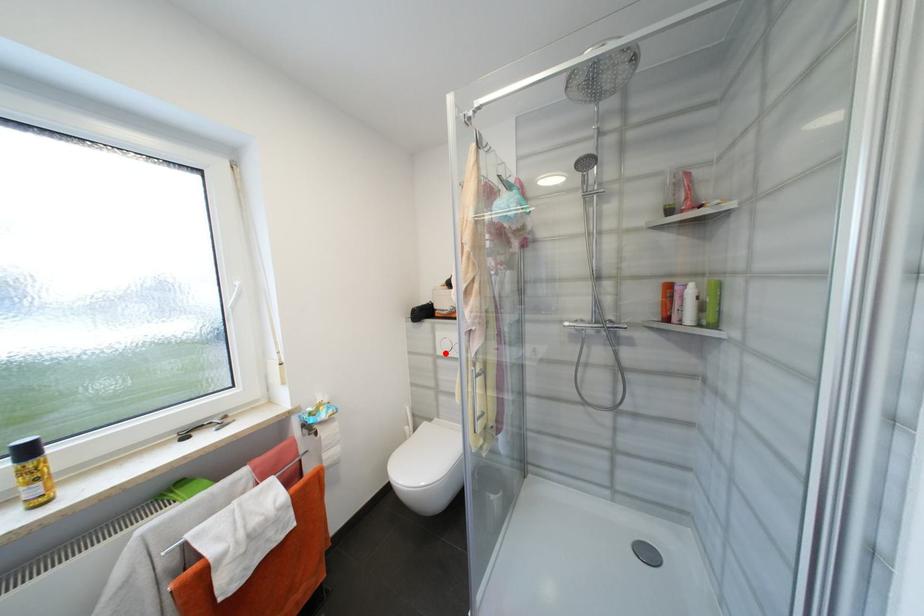
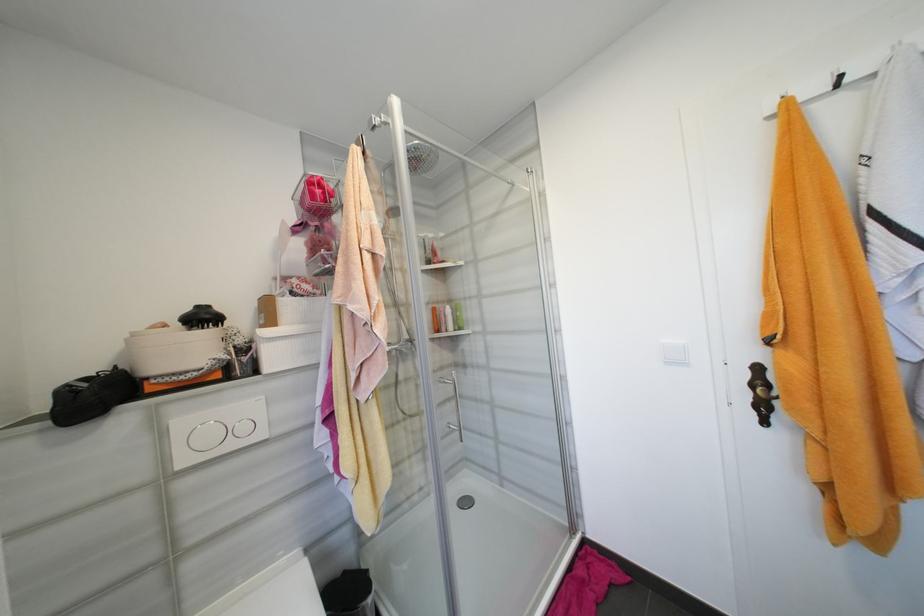
Question: I am providing you with two images of the same scene from different viewpoints. In image1, a red point is highlighted. Considering the same 3D point in image2, which of the following is correct?

Choices:
 (A) It is closer
 (B) It is farther

Answer: (A)